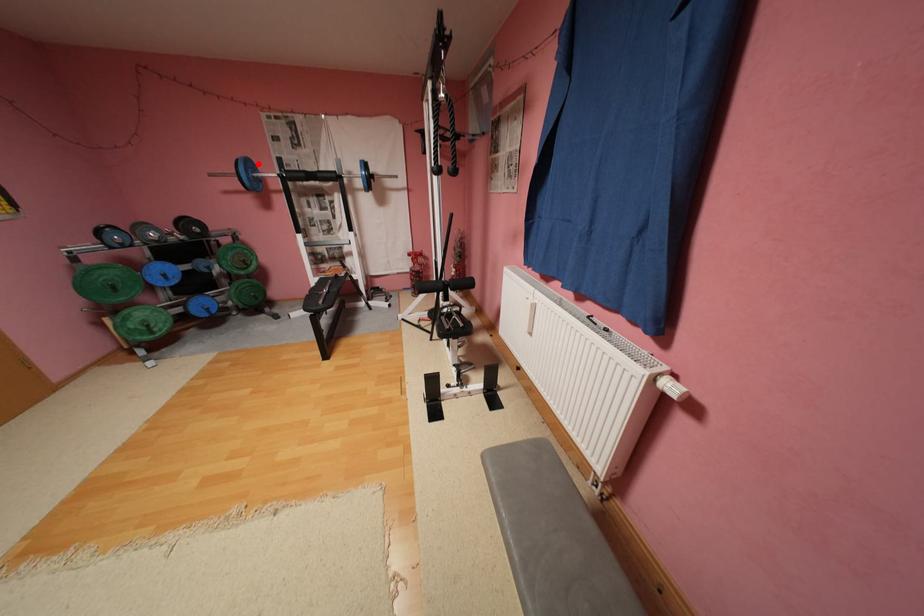
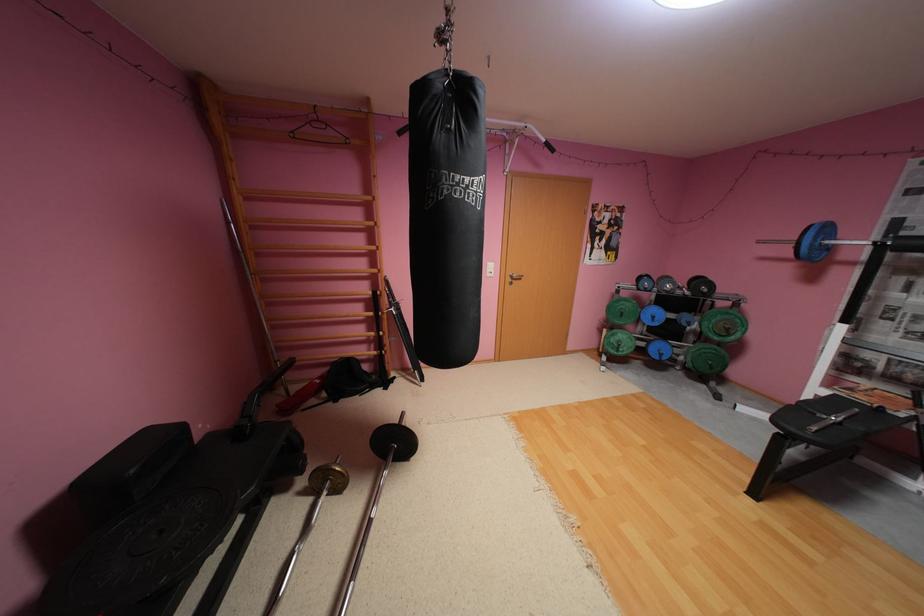
Locate, in the second image, the point that corresponds to the highlighted location in the first image.

(835, 229)